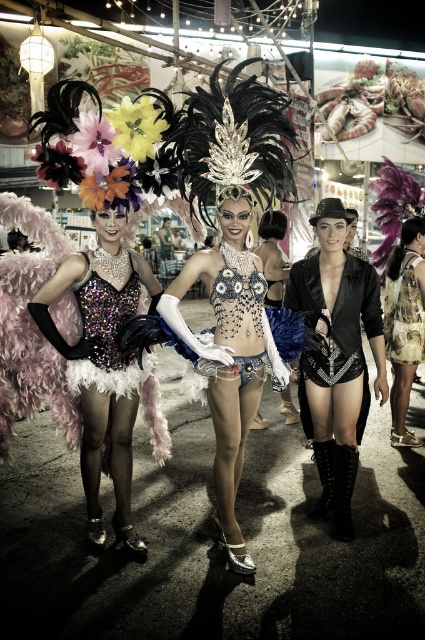
Question: Among these points, which one is farthest from the camera?

Choices:
 (A) (410, 333)
 (B) (340, 515)

Answer: (A)

Question: Can you confirm if sparkly silver dress at center is smaller than shiny sequined dress at center?

Choices:
 (A) no
 (B) yes

Answer: (A)

Question: Can you confirm if sparkly sequin dress at center is positioned above fur vest at center?

Choices:
 (A) no
 (B) yes

Answer: (A)

Question: Can you confirm if sparkly sequin dress at center is wider than shiny sequined dress at center?

Choices:
 (A) no
 (B) yes

Answer: (B)

Question: Which point is closer to the camera?

Choices:
 (A) sparkly silver dress at center
 (B) fur vest at center
 (C) shiny black leather shorts at center

Answer: (A)

Question: Estimate the real-world distances between objects in this image. Which object is farther from the sparkly sequin dress at center?

Choices:
 (A) sparkly sequined bodysuit at center
 (B) fur vest at center
 (C) sparkly silver dress at center
 (D) printed fabric dress at center

Answer: (D)